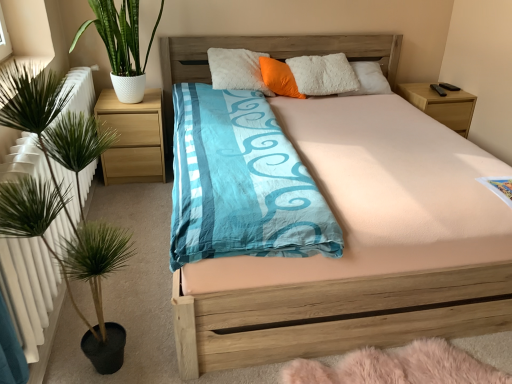
Question: From the image's perspective, is wooden bed at center positioned above or below green leafy plant at left, which ranks as the 2th houseplant in back-to-front order?

Choices:
 (A) below
 (B) above

Answer: (B)

Question: In the image, is wooden bed at center positioned in front of or behind green leafy plant at left, which ranks as the 2th houseplant in back-to-front order?

Choices:
 (A) behind
 (B) front

Answer: (A)

Question: Which object is the closest to the wooden bed at center?

Choices:
 (A) green leafy plant at left, marked as the second houseplant in a top-to-bottom arrangement
 (B) light wood/texture nightstand at right, which is the 2th nightstand from left to right
 (C) green leafy plant in white pot at left, which appears as the first houseplant when viewed from the top
 (D) light wood/finish nightstand at left, marked as the 1th nightstand in a left-to-right arrangement
 (E) orange fabric pillow at center

Answer: (A)

Question: Estimate the real-world distances between objects in this image. Which object is farther from the green leafy plant in white pot at left, which is the 2th houseplant from bottom to top?

Choices:
 (A) wooden bed at center
 (B) green leafy plant at left, marked as the 1th houseplant in a front-to-back arrangement
 (C) orange fabric pillow at center
 (D) light wood/texture nightstand at right, placed as the 1th nightstand when sorted from right to left
 (E) light wood/finish nightstand at left, marked as the 1th nightstand in a left-to-right arrangement

Answer: (D)